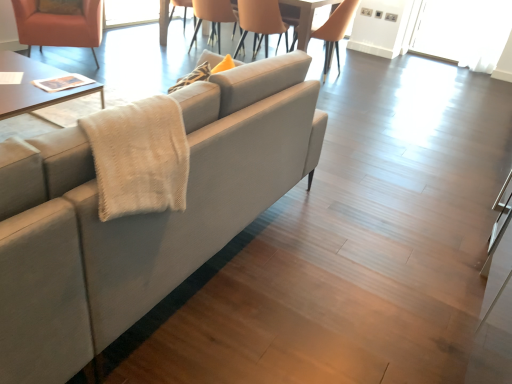
Find the location of a particular element. This screenshot has height=384, width=512. vacant area that lies to the right of light gray fabric couch at center is located at coordinates (357, 277).